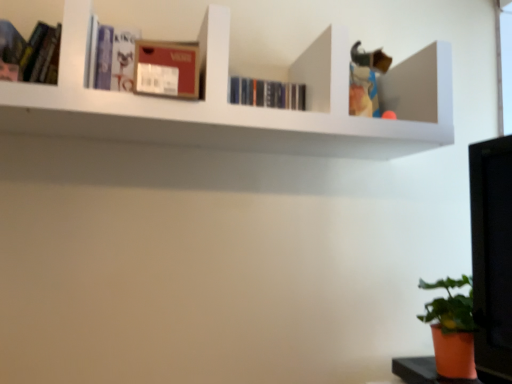
Question: Is white matte shelf at upper center positioned with its back to matte black book at upper left, acting as the 1th book starting from the front?

Choices:
 (A) yes
 (B) no

Answer: (B)

Question: Considering the relative sizes of white matte shelf at upper center and matte black book at upper left, which is the first book in left-to-right order, in the image provided, is white matte shelf at upper center wider than matte black book at upper left, which is the first book in left-to-right order,?

Choices:
 (A) yes
 (B) no

Answer: (A)

Question: Is white matte shelf at upper center not inside matte black book at upper left, arranged as the 2th book when viewed from the back?

Choices:
 (A) no
 (B) yes

Answer: (B)

Question: From a real-world perspective, is white matte shelf at upper center under matte black book at upper left, placed as the second book when sorted from right to left?

Choices:
 (A) yes
 (B) no

Answer: (B)

Question: Is the position of white matte shelf at upper center less distant than that of matte black book at upper left, arranged as the 2th book when viewed from the back?

Choices:
 (A) no
 (B) yes

Answer: (B)

Question: Can you confirm if white matte shelf at upper center is positioned to the right of matte black book at upper left, arranged as the 2th book when viewed from the back?

Choices:
 (A) yes
 (B) no

Answer: (A)

Question: Is white matte shelf at upper center closer to the viewer compared to orange matte pot at lower right?

Choices:
 (A) yes
 (B) no

Answer: (A)

Question: Does white matte shelf at upper center turn towards orange matte pot at lower right?

Choices:
 (A) yes
 (B) no

Answer: (B)

Question: Is white matte shelf at upper center further to camera compared to orange matte pot at lower right?

Choices:
 (A) yes
 (B) no

Answer: (B)

Question: Can you confirm if white matte shelf at upper center is bigger than orange matte pot at lower right?

Choices:
 (A) no
 (B) yes

Answer: (B)

Question: Can you confirm if white matte shelf at upper center is taller than orange matte pot at lower right?

Choices:
 (A) no
 (B) yes

Answer: (B)

Question: Is white matte shelf at upper center not near orange matte pot at lower right?

Choices:
 (A) yes
 (B) no

Answer: (B)

Question: Does orange matte pot at lower right lie behind matte black book at upper left, which is the first book in left-to-right order?

Choices:
 (A) no
 (B) yes

Answer: (B)